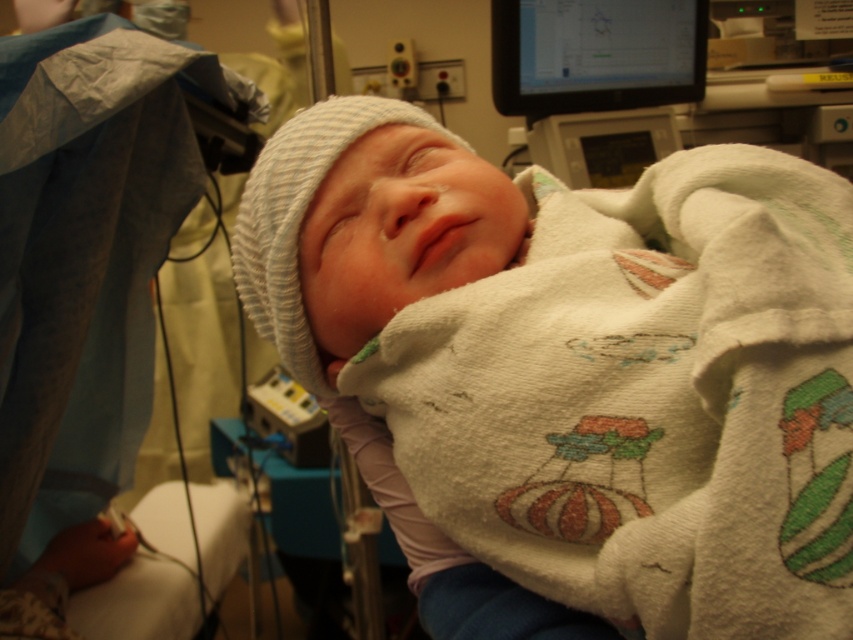
Question: Does white knit hat at center lie in front of black glossy monitor at upper right?

Choices:
 (A) yes
 (B) no

Answer: (A)

Question: Which of the following is the closest to the observer?

Choices:
 (A) (532, 120)
 (B) (345, 272)

Answer: (B)

Question: Does white knit hat at center have a lesser width compared to black glossy monitor at upper right?

Choices:
 (A) yes
 (B) no

Answer: (B)

Question: Does white knit hat at center appear on the right side of black glossy monitor at upper right?

Choices:
 (A) yes
 (B) no

Answer: (B)

Question: Which point is farther to the camera?

Choices:
 (A) black glossy monitor at upper right
 (B) white knit hat at center

Answer: (A)